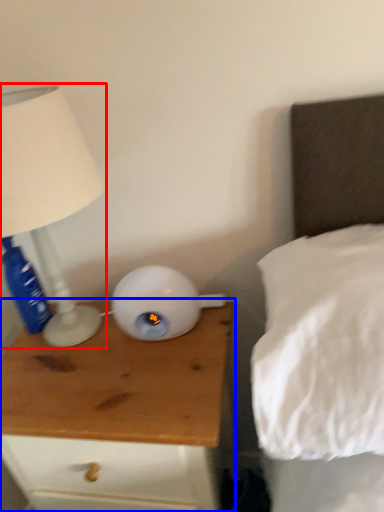
Question: Which point is further to the camera, lamp (highlighted by a red box) or nightstand (highlighted by a blue box)?

Choices:
 (A) lamp
 (B) nightstand

Answer: (B)